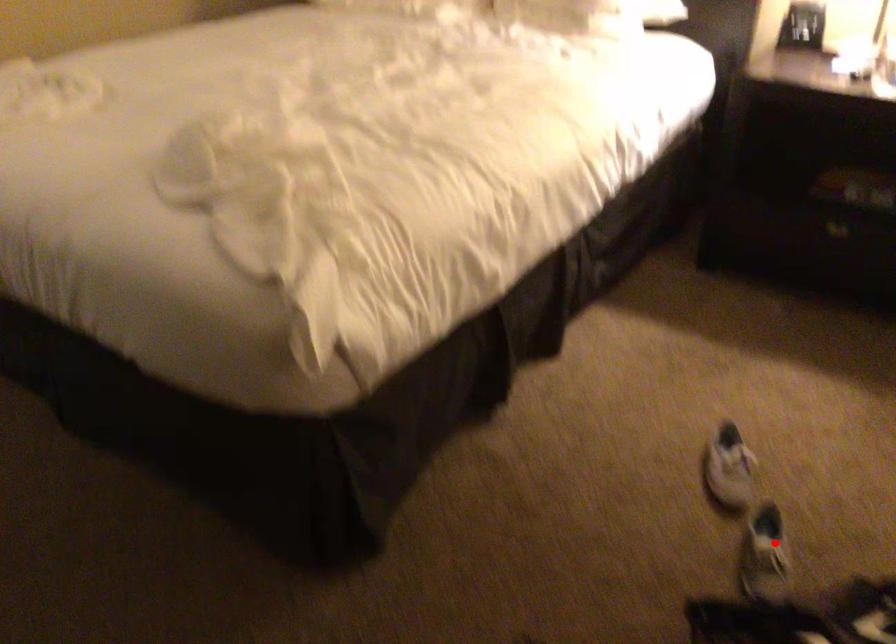
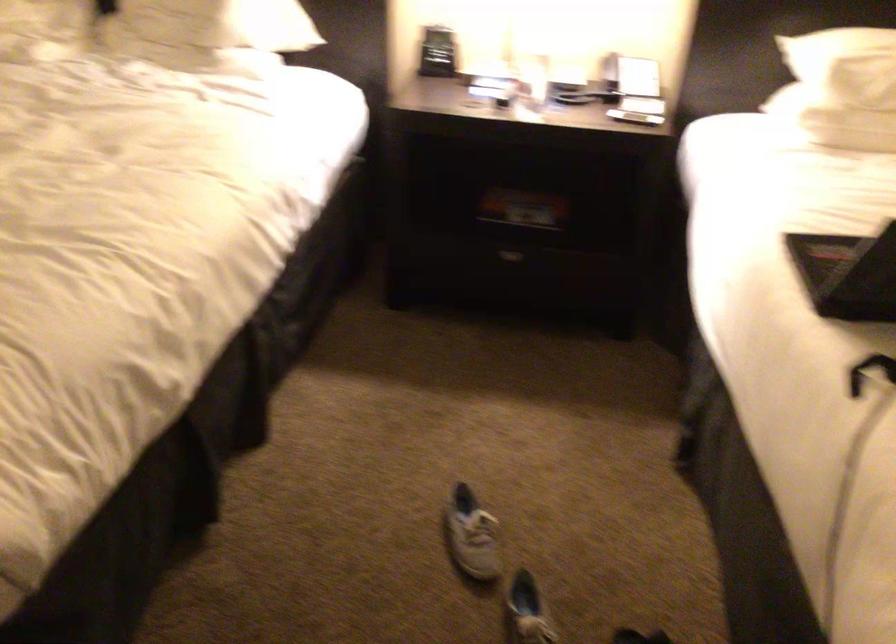
In the second image, find the point that corresponds to the highlighted location in the first image.

(528, 607)